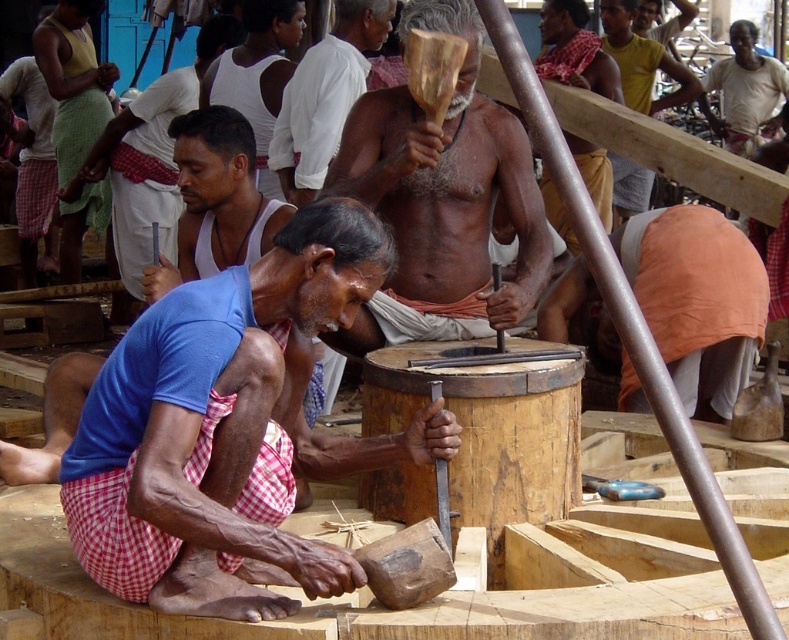
Question: Is wooden mallet at center below matte white shirt at upper left?

Choices:
 (A) yes
 (B) no

Answer: (A)

Question: Can you confirm if white cotton tank top at upper left is positioned to the right of light beige cotton shirt at upper right?

Choices:
 (A) no
 (B) yes

Answer: (A)

Question: Which object is the farthest from the blue cotton shirt at center?

Choices:
 (A) yellow-green fabric at upper left
 (B) brown wooden stick at upper center
 (C) light beige cotton shirt at upper right

Answer: (C)

Question: Which object is positioned closest to the yellow-green fabric at upper left?

Choices:
 (A) matte white shirt at upper left
 (B) wooden mallet at center
 (C) blue cotton shirt at center
 (D) white cotton tank top at upper left

Answer: (A)

Question: Considering the real-world distances, which object is closest to the orange fabric at lower right?

Choices:
 (A) light beige cotton shirt at upper right
 (B) white cotton tank top at upper left

Answer: (B)

Question: Can you confirm if orange fabric at lower right is positioned to the left of brown wooden stick at upper center?

Choices:
 (A) yes
 (B) no

Answer: (A)